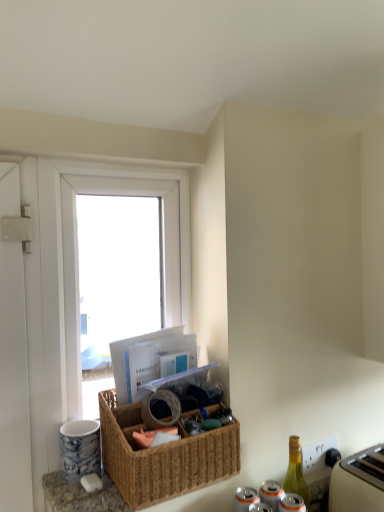
Question: From a real-world perspective, is green glass bottle at lower right above or below woven brown picnic basket at center?

Choices:
 (A) above
 (B) below

Answer: (B)

Question: Choose the correct answer: Is green glass bottle at lower right inside woven brown picnic basket at center or outside it?

Choices:
 (A) outside
 (B) inside

Answer: (A)

Question: Considering the real-world distances, which object is farthest from the white plastic toaster at lower right?

Choices:
 (A) white plastic window at upper left
 (B) woven brown picnic basket at center
 (C) green glass bottle at lower right

Answer: (A)

Question: Based on their relative distances, which object is nearer to the green glass bottle at lower right?

Choices:
 (A) woven brown picnic basket at center
 (B) white plastic window at upper left
 (C) white plastic toaster at lower right

Answer: (C)